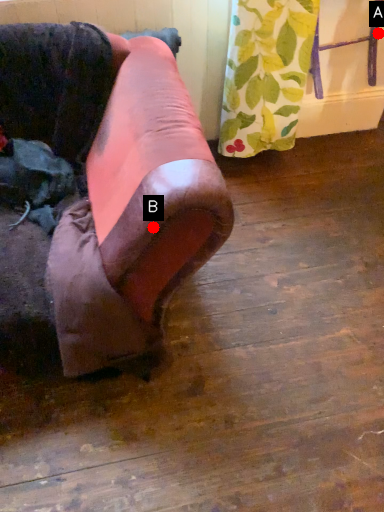
Question: Two points are circled on the image, labeled by A and B beside each circle. Which point appears closest to the camera in this image?

Choices:
 (A) A is closer
 (B) B is closer

Answer: (B)